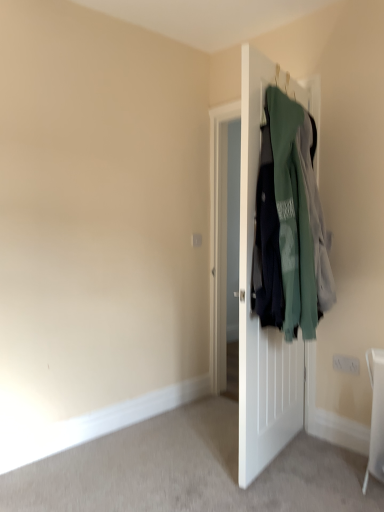
Locate an element on the screen. This screenshot has height=512, width=384. blank area to the left of white matte door at center is located at coordinates (178, 441).